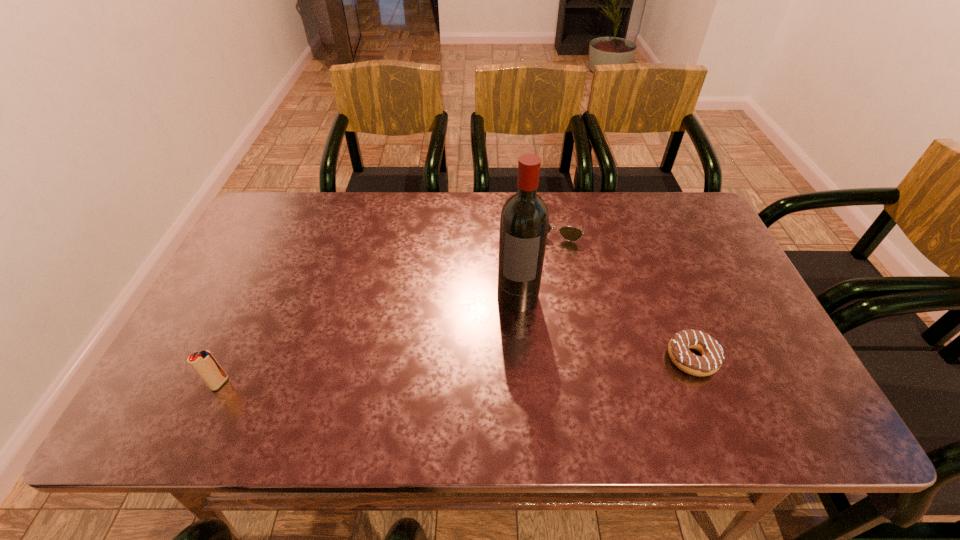
Where is `object present at the right edge`? object present at the right edge is located at coordinates [712, 357].

Identify the location of object that is at the near left corner. (205, 365).

Identify the location of object located in the near right corner section of the desktop. Image resolution: width=960 pixels, height=540 pixels. (712, 357).

In the image, there is a desktop. Identify the location of vacant space at the far edge. (445, 222).

The image size is (960, 540). In the image, there is a desktop. What are the coordinates of `vacant space at the near edge` in the screenshot? It's located at (602, 370).

Image resolution: width=960 pixels, height=540 pixels. Find the location of `vacant space at the left edge`. vacant space at the left edge is located at coordinates (195, 341).

You are a GUI agent. You are given a task and a screenshot of the screen. Output one action in this format:
    pyautogui.click(x=<x>, y=<y>)
    Task: Click on the blank space at the right edge
    
    Given the screenshot: What is the action you would take?
    pyautogui.click(x=745, y=331)

In the image, there is a desktop. At what (x,y) coordinates should I click in order to perform the action: click on free region at the far left corner. Please return your answer as a coordinate pair (x, y). Looking at the image, I should click on (278, 236).

Locate an element on the screen. The image size is (960, 540). blank space at the near left corner of the desktop is located at coordinates (225, 361).

This screenshot has width=960, height=540. Identify the location of free region at the far right corner. (663, 217).